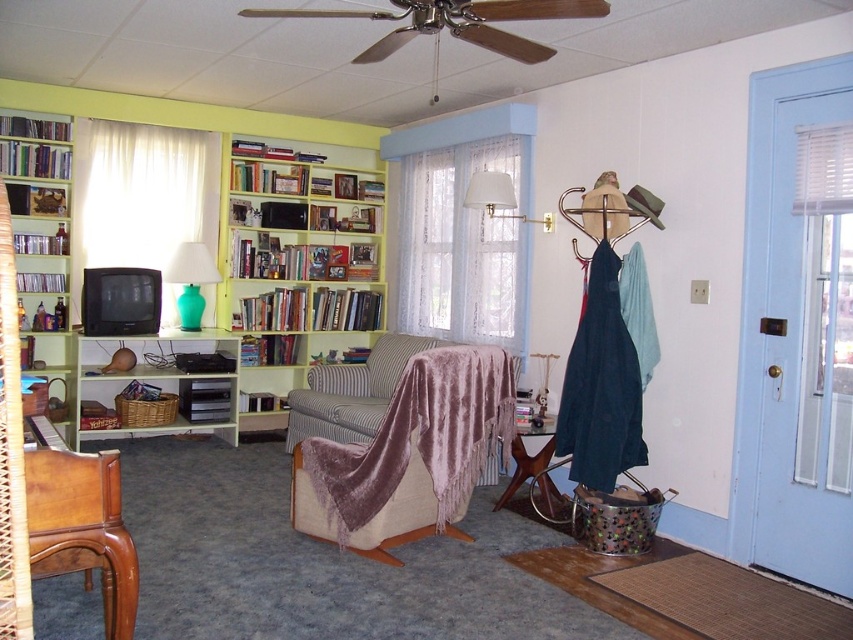
In the scene shown: Who is higher up, wooden armchair at lower left or white fabric lampshade at upper center?

Positioned higher is white fabric lampshade at upper center.

Can you confirm if wooden armchair at lower left is taller than white fabric lampshade at upper center?

Indeed, wooden armchair at lower left has a greater height compared to white fabric lampshade at upper center.

Does point (115, 552) lie behind point (498, 189)?

No.

Image resolution: width=853 pixels, height=640 pixels. What are the coordinates of `wooden armchair at lower left` in the screenshot? It's located at (82, 528).

The image size is (853, 640). I want to click on white lace curtain at center, so click(462, 248).

Can you confirm if white lace curtain at center is positioned above wooden armchair at lower left?

Yes.

What do you see at coordinates (462, 248) in the screenshot? The width and height of the screenshot is (853, 640). I see `white lace curtain at center` at bounding box center [462, 248].

Locate an element on the screen. Image resolution: width=853 pixels, height=640 pixels. white lace curtain at center is located at coordinates (462, 248).

Who is positioned more to the right, wooden armchair at lower left or teal glass lamp at center?

wooden armchair at lower left

Who is shorter, wooden armchair at lower left or teal glass lamp at center?

wooden armchair at lower left

Who is more forward, (64, 461) or (178, 250)?

Point (64, 461) is in front.

Locate an element on the screen. The width and height of the screenshot is (853, 640). wooden armchair at lower left is located at coordinates (82, 528).